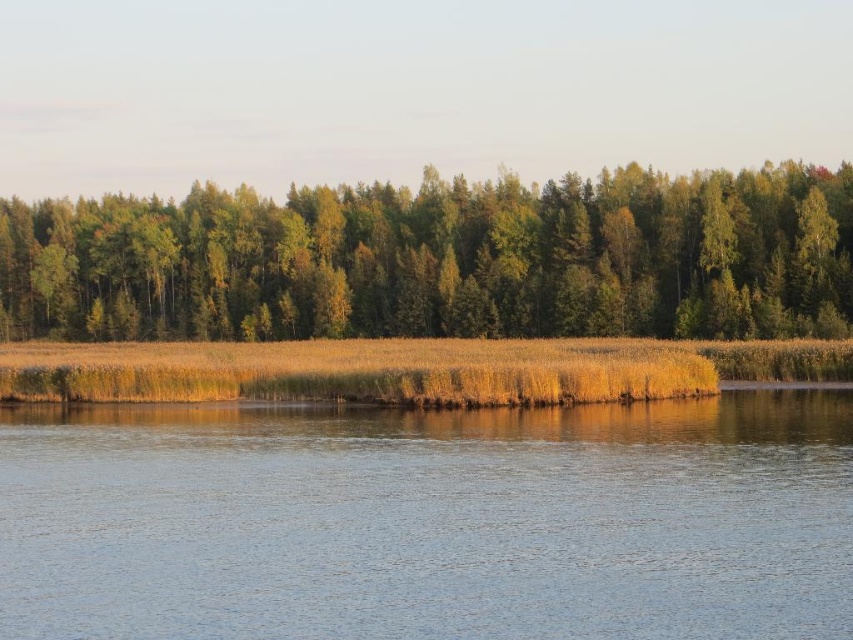
Which is above, blue water at center or green leafy trees at center?

green leafy trees at center

Is blue water at center shorter than green leafy trees at center?

Yes.

Does point (407, 534) lie in front of point (810, 202)?

Yes, point (407, 534) is in front of point (810, 202).

The width and height of the screenshot is (853, 640). What are the coordinates of `blue water at center` in the screenshot? It's located at (428, 522).